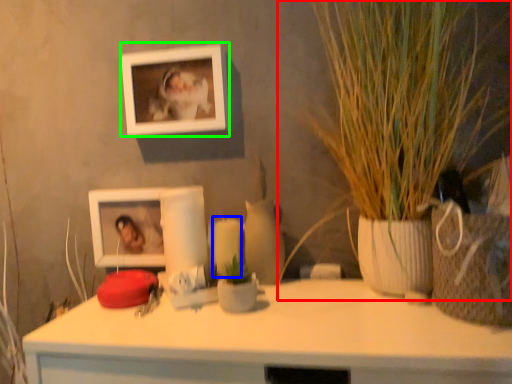
Question: Which object is the closest to the houseplant (highlighted by a red box)? Choose among these: candle (highlighted by a blue box) or picture frame (highlighted by a green box).

Choices:
 (A) candle
 (B) picture frame

Answer: (B)